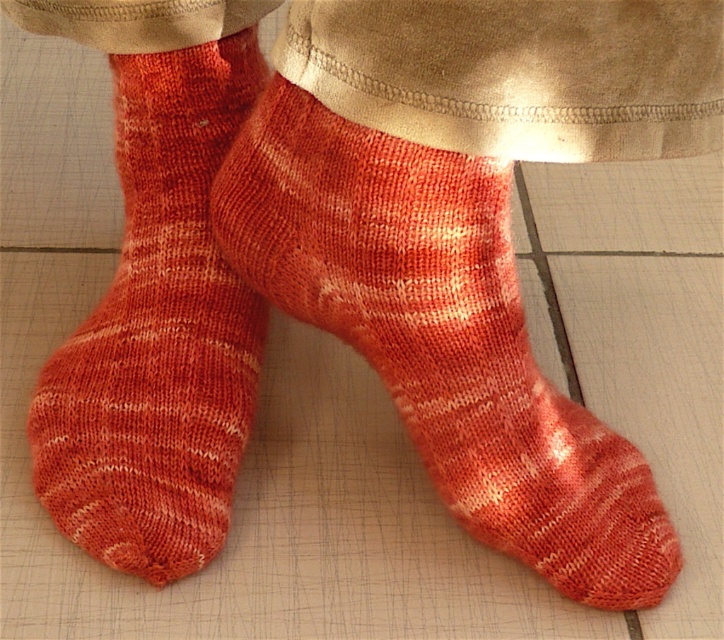
You are a fashion designer analyzing the placement of the knitted woolen sock at center in an image. Based on the coordinates provided, would you say the sock is positioned closer to the top or bottom of the image?

The knitted woolen sock at center is positioned at coordinates point (441, 337). Since the y coordinate is 0.610, which is closer to 1.0 than 0.0, the sock is closer to the bottom of the image.

You are standing in a room and see the image. There is a knitted woolen sock at center marked by the point [441,337]. Can you tell me what color the sock is?

The knitted woolen sock at center marked by the point [441,337] is a warm, reddish orange color with subtle variations in shade, giving it a slightly mottled appearance.

You are a fashion designer examining the image of a person wearing socks. You notice two items labeled knitted woolen sock at center and knitted orange socks at center. Which of these is closer to the floor?

The knitted woolen sock at center is positioned under the knitted orange socks at center, so it is closer to the floor.